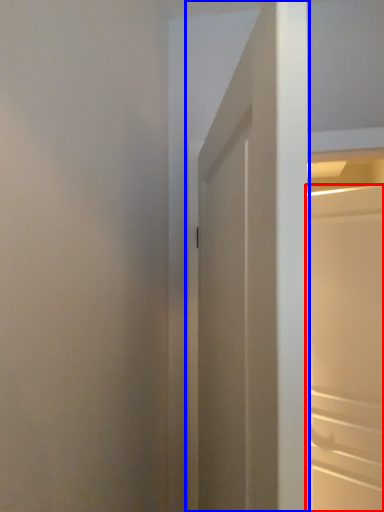
Question: Among these objects, which one is nearest to the camera, door (highlighted by a red box) or door (highlighted by a blue box)?

Choices:
 (A) door
 (B) door

Answer: (B)